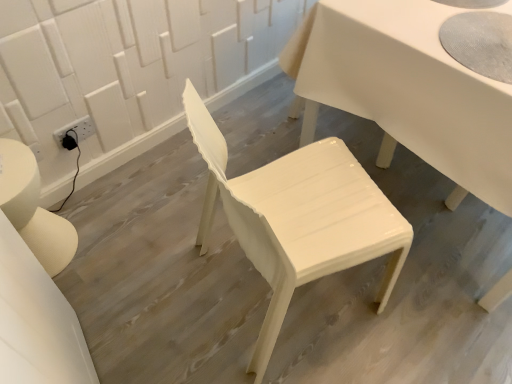
The image size is (512, 384). Identify the location of glossy white chair at center. (298, 218).

What do you see at coordinates (298, 218) in the screenshot?
I see `glossy white chair at center` at bounding box center [298, 218].

What do you see at coordinates (405, 90) in the screenshot? I see `glossy white table at center` at bounding box center [405, 90].

Locate an element on the screen. This screenshot has width=512, height=384. glossy white table at center is located at coordinates (405, 90).

This screenshot has width=512, height=384. I want to click on glossy white chair at center, so click(x=298, y=218).

Would you say glossy white chair at center is to the left or to the right of glossy white table at center in the picture?

Based on their positions, glossy white chair at center is located to the left of glossy white table at center.

Which object is further away from the camera taking this photo, glossy white chair at center or glossy white table at center?

glossy white table at center is more distant.

Does point (277, 266) come closer to viewer compared to point (310, 96)?

That is True.

From the image's perspective, is glossy white chair at center above glossy white table at center?

No, from the image's perspective, glossy white chair at center is not above glossy white table at center.

From a real-world perspective, is glossy white chair at center on glossy white table at center?

Indeed, from a real-world perspective, glossy white chair at center stands above glossy white table at center.

Does glossy white chair at center have a greater width compared to glossy white table at center?

Incorrect, the width of glossy white chair at center does not surpass that of glossy white table at center.

Considering the sizes of objects glossy white chair at center and glossy white table at center in the image provided, who is taller, glossy white chair at center or glossy white table at center?

With more height is glossy white chair at center.

Considering the relative sizes of glossy white chair at center and glossy white table at center in the image provided, is glossy white chair at center bigger than glossy white table at center?

Actually, glossy white chair at center might be smaller than glossy white table at center.

Could glossy white table at center be considered to be inside glossy white chair at center?

No, glossy white table at center is located outside of glossy white chair at center.

Are glossy white chair at center and glossy white table at center making contact?

No, glossy white chair at center is not next to glossy white table at center.

Is glossy white chair at center oriented away from glossy white table at center?

No, glossy white chair at center's orientation is not away from glossy white table at center.

How many degrees apart are the facing directions of glossy white chair at center and glossy white table at center?

69.4 degrees.

Find the location of `table behind the glossy white chair at center`. table behind the glossy white chair at center is located at coordinates (405, 90).

Does glossy white table at center appear on the right side of glossy white chair at center?

Yes, glossy white table at center is to the right of glossy white chair at center.

Who is more distant, glossy white table at center or glossy white chair at center?

glossy white table at center is behind.

Which is closer, (378, 45) or (218, 166)?

Point (378, 45).

From the image's perspective, relative to glossy white chair at center, is glossy white table at center above or below?

Based on their image positions, glossy white table at center is located above glossy white chair at center.

From a real-world perspective, is glossy white table at center physically above glossy white chair at center?

No, from a real-world perspective, glossy white table at center is not over glossy white chair at center

In terms of width, does glossy white table at center look wider or thinner when compared to glossy white chair at center?

glossy white table at center is wider than glossy white chair at center.

Is glossy white table at center taller than glossy white chair at center?

Incorrect, the height of glossy white table at center is not larger of that of glossy white chair at center.

Is glossy white table at center bigger than glossy white chair at center?

Indeed, glossy white table at center has a larger size compared to glossy white chair at center.

Would you say glossy white chair at center is part of glossy white table at center's contents?

That's incorrect, glossy white chair at center is not inside glossy white table at center.

Consider the image. Is glossy white table at center touching glossy white chair at center?

glossy white table at center is not next to glossy white chair at center, and they're not touching.

Could you tell me if glossy white table at center is turned towards glossy white chair at center?

No, glossy white table at center is not facing towards glossy white chair at center.

The image size is (512, 384). In the image, there is a glossy white chair at center. In order to click on table above it (from the image's perspective) in this screenshot , I will do `click(405, 90)`.

This screenshot has width=512, height=384. In order to click on chair in front of the glossy white table at center in this screenshot , I will do `click(298, 218)`.

Identify the location of chair on the left of the glossy white table at center. (298, 218).